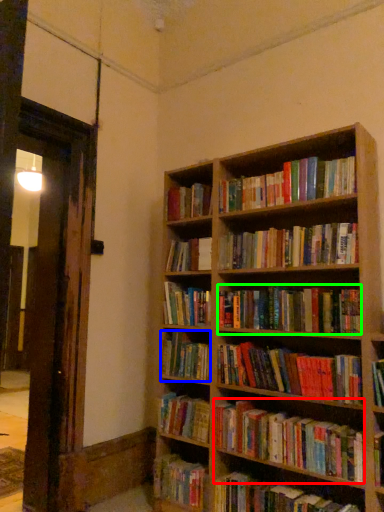
Question: Considering the real-world distances, which object is closest to book (highlighted by a red box)? book (highlighted by a blue box) or book (highlighted by a green box).

Choices:
 (A) book
 (B) book

Answer: (A)